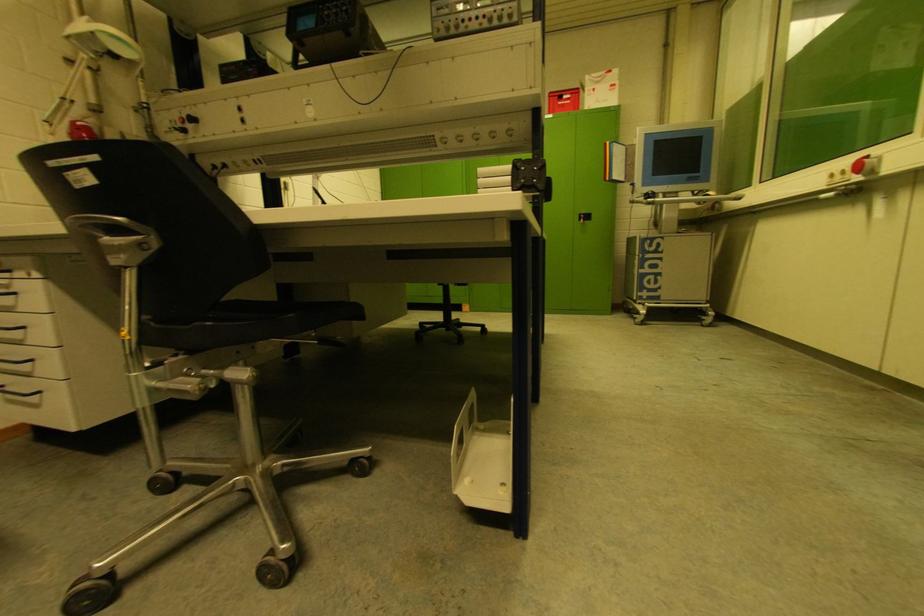
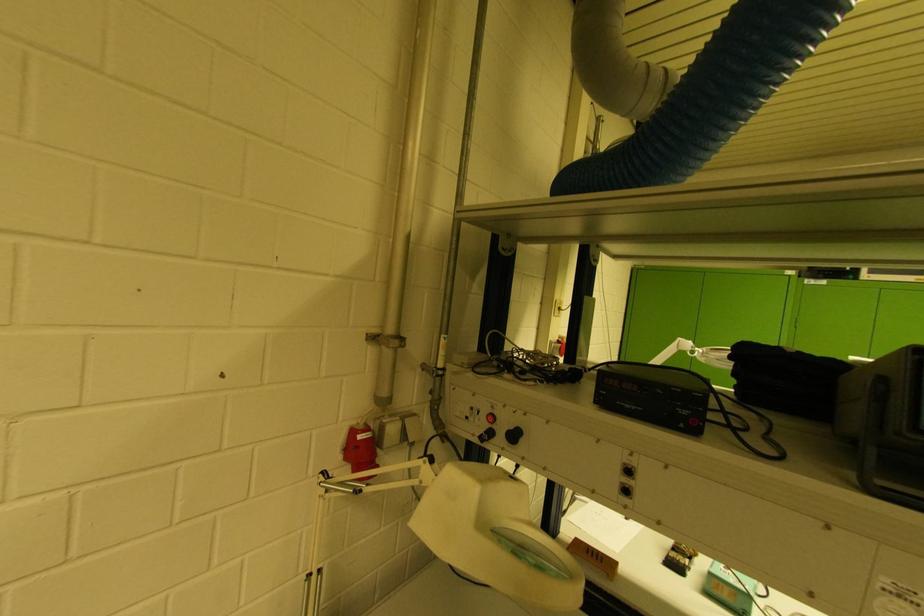
Which direction would the cameraman need to move to produce the second image?

The cameraman walked toward left, forward.